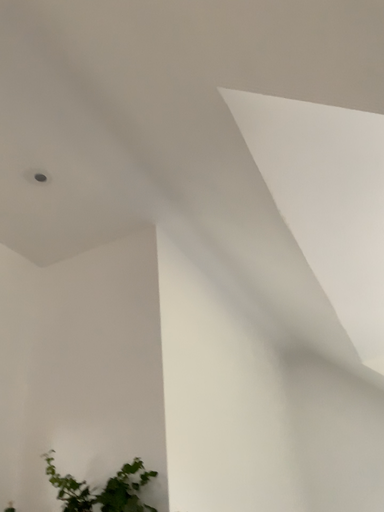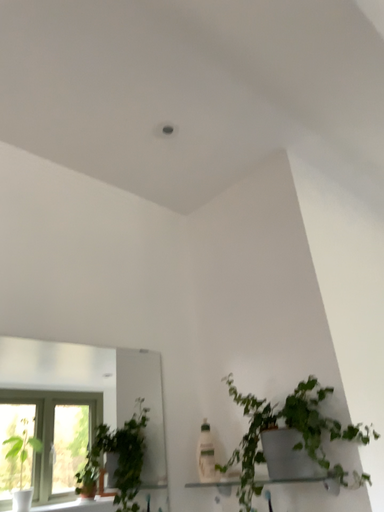
Question: How did the camera likely rotate when shooting the video?

Choices:
 (A) rotated upward
 (B) rotated downward

Answer: (B)